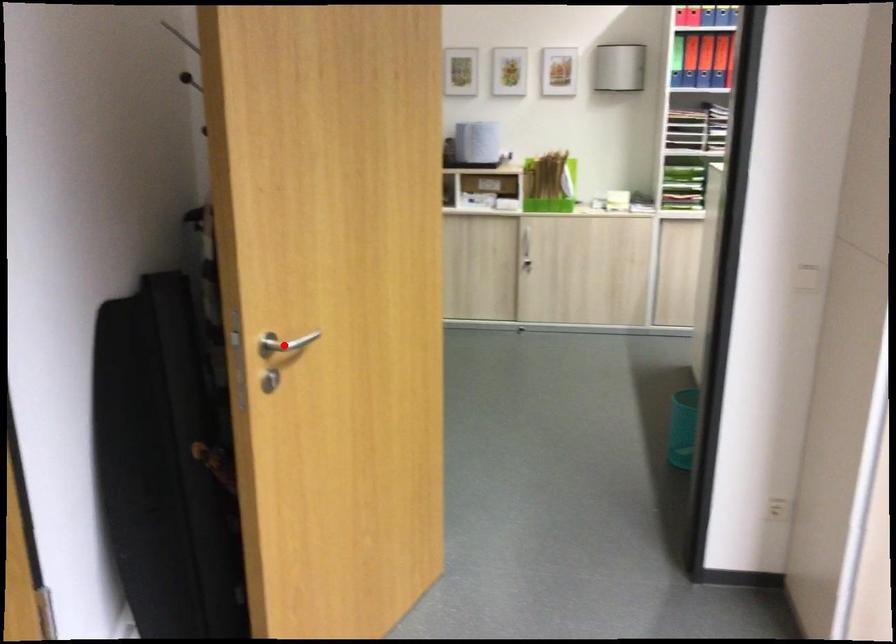
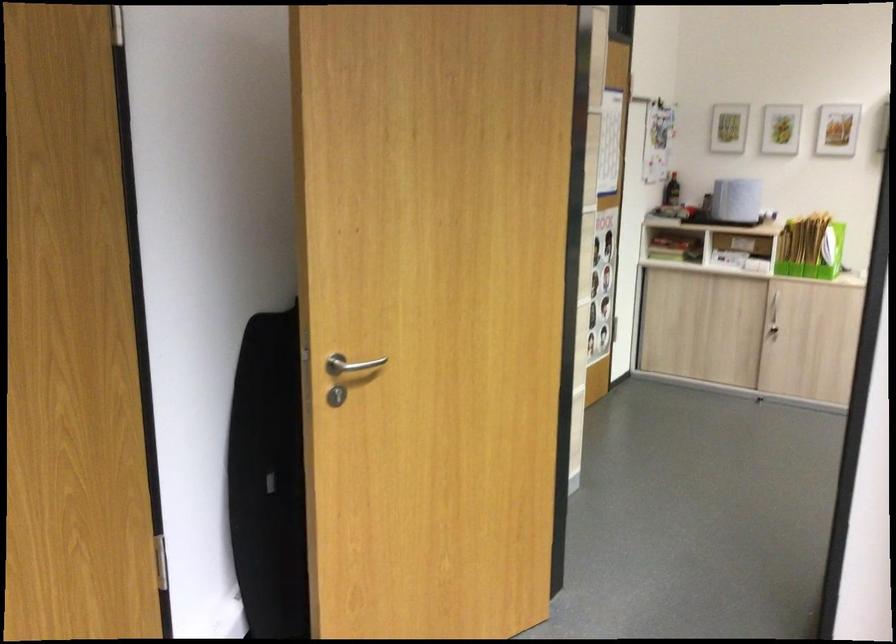
Question: A red point is marked in image1. In image2, is the corresponding 3D point closer to the camera or farther? Reply with the corresponding letter.

Choices:
 (A) The corresponding 3D point is closer.
 (B) The corresponding 3D point is farther.

Answer: (B)